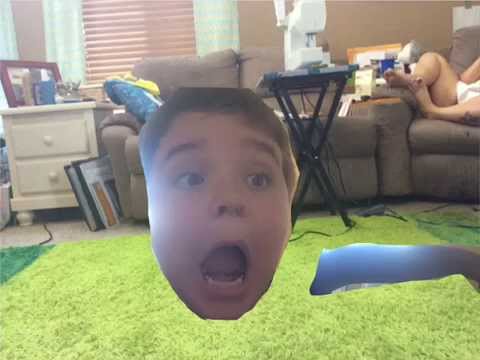
This screenshot has height=360, width=480. I want to click on dresser, so click(x=66, y=136).